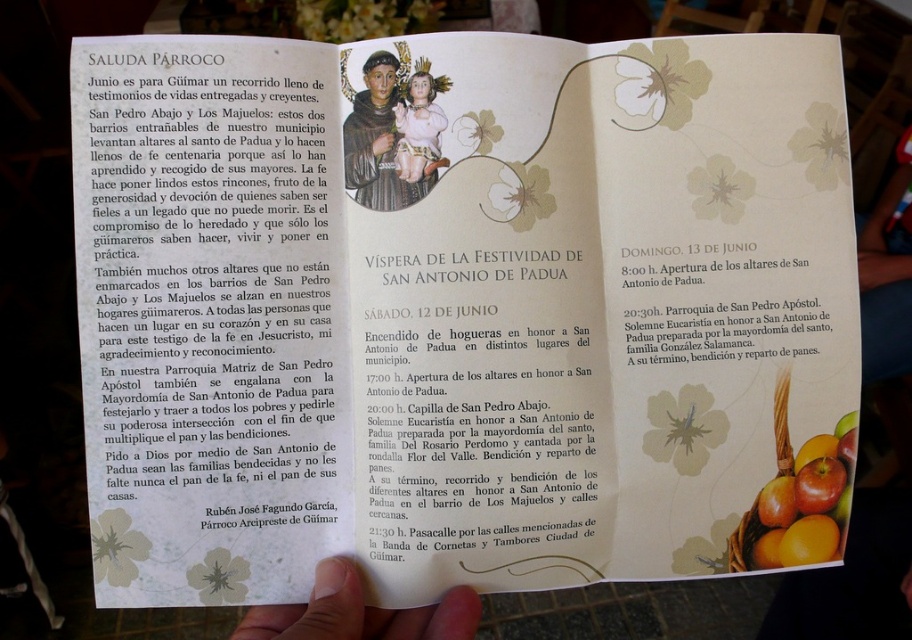
Between flesh-toned skin at lower center and shiny red apples at lower right, which one has less height?

flesh-toned skin at lower center

Who is more distant from viewer, (x=361, y=595) or (x=825, y=531)?

Positioned behind is point (x=825, y=531).

Where is `flesh-toned skin at lower center`? Image resolution: width=912 pixels, height=640 pixels. flesh-toned skin at lower center is located at coordinates (359, 612).

Is matte black saint at upper center below matte porcelain baby at upper center?

Yes.

Which of these two, matte black saint at upper center or matte porcelain baby at upper center, stands taller?

matte black saint at upper center

Based on the photo, who is more forward, (397,68) or (410,132)?

Point (410,132)

Find the location of a particular element. Image resolution: width=912 pixels, height=640 pixels. matte black saint at upper center is located at coordinates (394, 132).

Can you confirm if shiny red apples at lower right is positioned below matte porcelain baby at upper center?

Correct, shiny red apples at lower right is located below matte porcelain baby at upper center.

Is point (824, 435) more distant than point (412, 182)?

Yes, it is behind point (412, 182).

In order to click on shiny red apples at lower right in this screenshot , I will do `click(806, 502)`.